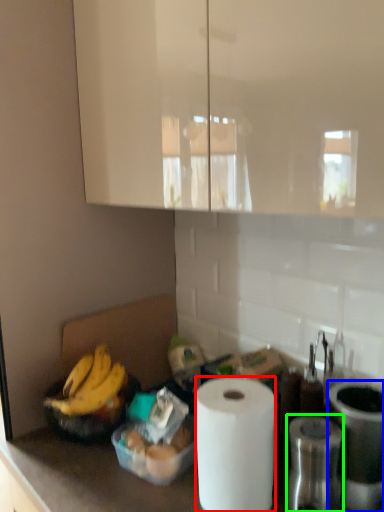
Question: Based on their relative distances, which object is nearer to paper towel (highlighted by a red box)? Choose from appliance (highlighted by a blue box) and appliance (highlighted by a green box).

Choices:
 (A) appliance
 (B) appliance

Answer: (B)